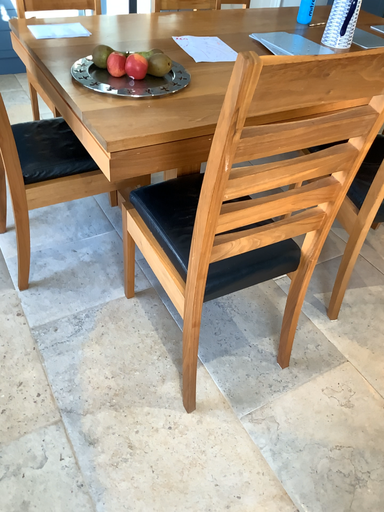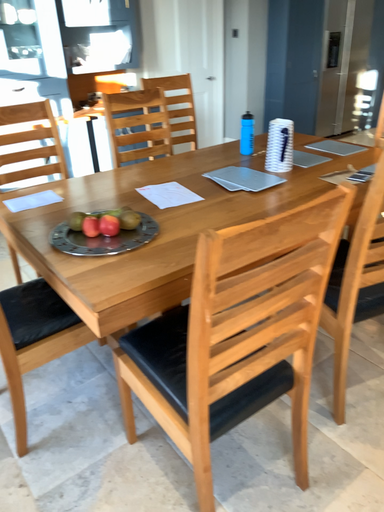
Question: Which way did the camera rotate in the video?

Choices:
 (A) rotated downward
 (B) rotated upward

Answer: (B)